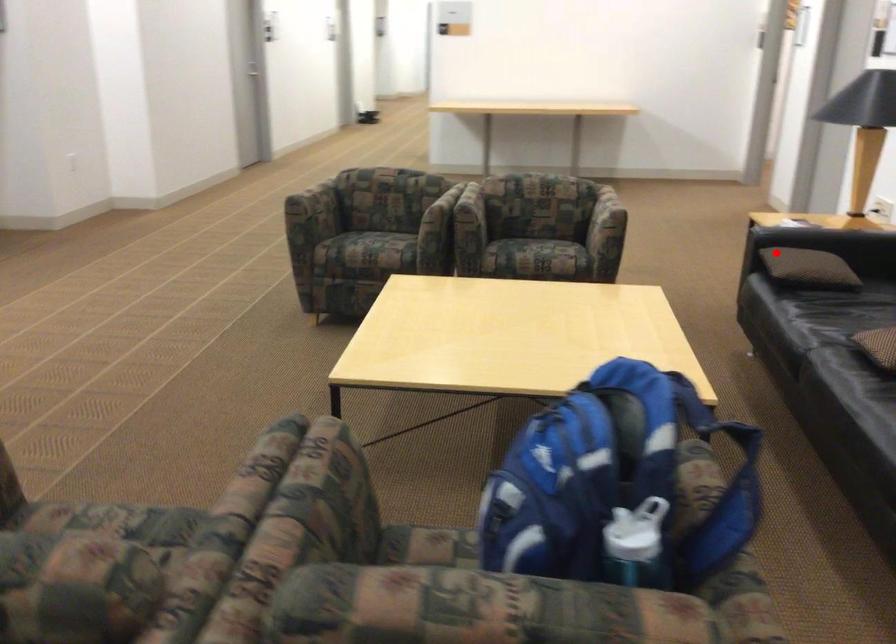
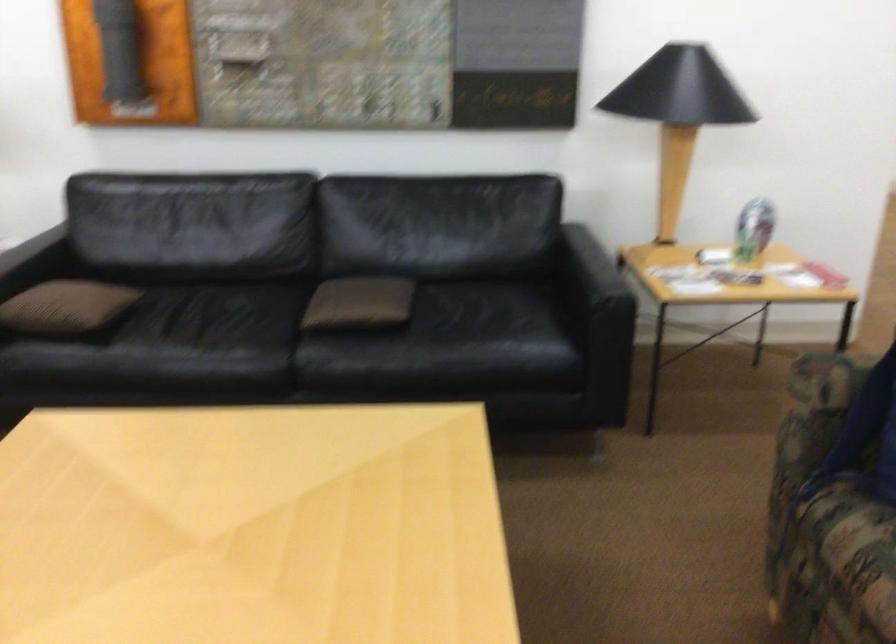
The point at the highlighted location is marked in the first image. Where is the corresponding point in the second image?

(65, 308)